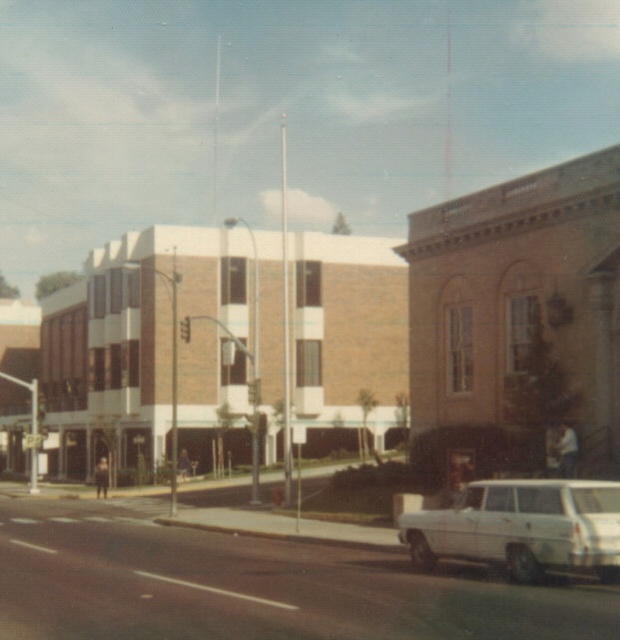
Question: Is brick building at center to the left of white matte station wagon at lower right from the viewer's perspective?

Choices:
 (A) no
 (B) yes

Answer: (B)

Question: Is brick building at center further to the viewer compared to white matte station wagon at lower right?

Choices:
 (A) no
 (B) yes

Answer: (B)

Question: Which point appears farthest from the camera in this image?

Choices:
 (A) pyautogui.click(x=578, y=554)
 (B) pyautogui.click(x=117, y=285)

Answer: (B)

Question: Which point appears farthest from the camera in this image?

Choices:
 (A) (508, 397)
 (B) (412, 520)

Answer: (A)

Question: Is brick building at center in front of white matte station wagon at lower right?

Choices:
 (A) yes
 (B) no

Answer: (B)

Question: Which point is farther to the camera?

Choices:
 (A) white matte station wagon at lower right
 (B) brick building at center

Answer: (B)